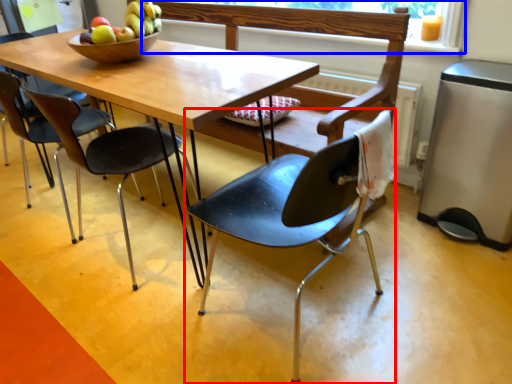
Question: Which point is further to the camera, chair (highlighted by a red box) or window screen (highlighted by a blue box)?

Choices:
 (A) chair
 (B) window screen

Answer: (B)